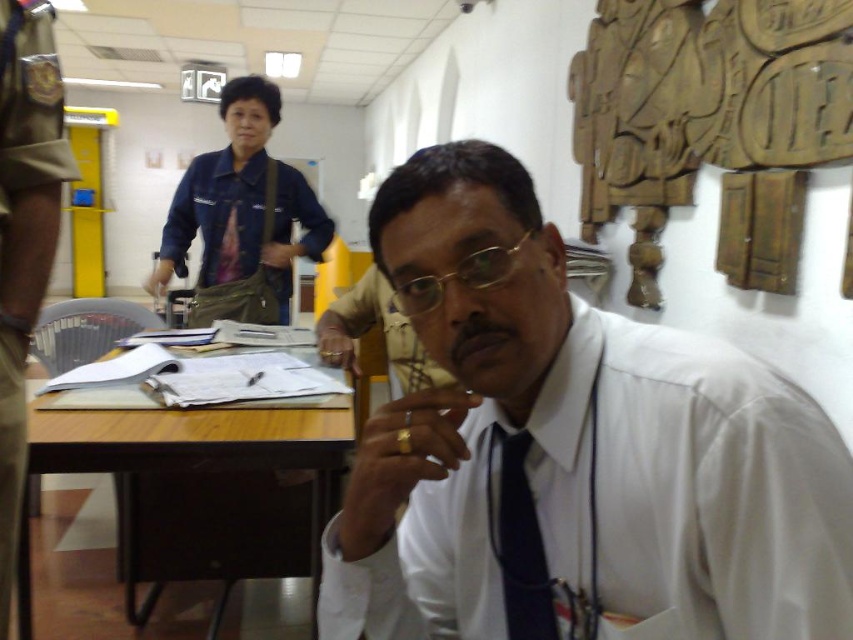
Is wooden at left to the right of khaki uniform at left from the viewer's perspective?

Indeed, wooden at left is positioned on the right side of khaki uniform at left.

Is wooden at left to the left of khaki uniform at left from the viewer's perspective?

In fact, wooden at left is to the right of khaki uniform at left.

Which is behind, point (28, 412) or point (32, 209)?

The point (28, 412) is more distant.

This screenshot has height=640, width=853. Find the location of `wooden at left`. wooden at left is located at coordinates (202, 470).

Between white glossy shirt at center and wooden at left, which one appears on the right side from the viewer's perspective?

white glossy shirt at center is more to the right.

Is point (547, 509) positioned in front of point (309, 563)?

Yes, it is in front of point (309, 563).

What are the coordinates of `white glossy shirt at center` in the screenshot? It's located at (572, 451).

This screenshot has height=640, width=853. What do you see at coordinates (24, 234) in the screenshot? I see `khaki uniform at left` at bounding box center [24, 234].

Is point (15, 288) positioned after point (526, 435)?

Yes.

The width and height of the screenshot is (853, 640). What do you see at coordinates (24, 234) in the screenshot?
I see `khaki uniform at left` at bounding box center [24, 234].

Identify the location of khaki uniform at left. (24, 234).